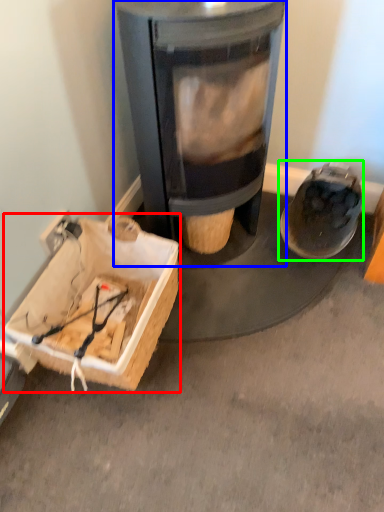
Question: Based on their relative distances, which object is farther from cardboard box (highlighted by a red box)? Choose from wood burning stove (highlighted by a blue box) and footwear (highlighted by a green box).

Choices:
 (A) wood burning stove
 (B) footwear

Answer: (B)